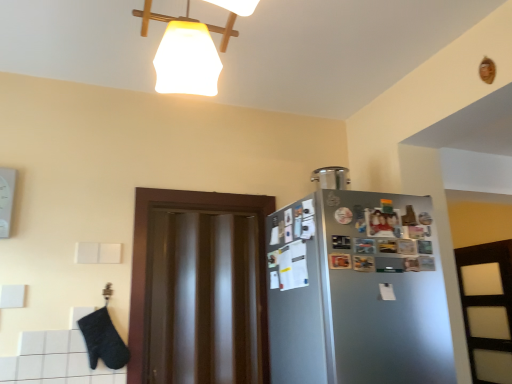
Question: Does satin silver fridge at right lie in front of satin silver container at upper right?

Choices:
 (A) no
 (B) yes

Answer: (B)

Question: Would you say satin silver fridge at right is outside satin silver container at upper right?

Choices:
 (A) yes
 (B) no

Answer: (A)

Question: From the image's perspective, does satin silver fridge at right appear lower than satin silver container at upper right?

Choices:
 (A) yes
 (B) no

Answer: (A)

Question: Is satin silver fridge at right thinner than satin silver container at upper right?

Choices:
 (A) yes
 (B) no

Answer: (B)

Question: Is satin silver fridge at right oriented away from satin silver container at upper right?

Choices:
 (A) yes
 (B) no

Answer: (B)

Question: Can you confirm if satin silver fridge at right is smaller than satin silver container at upper right?

Choices:
 (A) yes
 (B) no

Answer: (B)

Question: From the image's perspective, would you say transparent glossy door at center is positioned over satin silver container at upper right?

Choices:
 (A) yes
 (B) no

Answer: (B)

Question: Considering the relative sizes of transparent glossy door at center and satin silver container at upper right in the image provided, is transparent glossy door at center wider than satin silver container at upper right?

Choices:
 (A) yes
 (B) no

Answer: (B)

Question: Can we say transparent glossy door at center lies outside satin silver container at upper right?

Choices:
 (A) no
 (B) yes

Answer: (B)

Question: Would you say satin silver container at upper right is part of transparent glossy door at center's contents?

Choices:
 (A) no
 (B) yes

Answer: (A)

Question: Is transparent glossy door at center bigger than satin silver container at upper right?

Choices:
 (A) no
 (B) yes

Answer: (B)

Question: From the image's perspective, is transparent glossy door at center beneath satin silver container at upper right?

Choices:
 (A) yes
 (B) no

Answer: (A)

Question: Considering the relative sizes of satin silver container at upper right and transparent glossy door at center in the image provided, is satin silver container at upper right bigger than transparent glossy door at center?

Choices:
 (A) yes
 (B) no

Answer: (B)